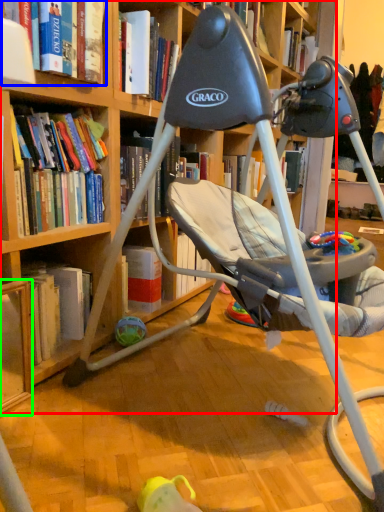
Question: Which object is the closest to the bookcase (highlighted by a red box)? Choose among these: book (highlighted by a blue box) or shelf (highlighted by a green box).

Choices:
 (A) book
 (B) shelf

Answer: (B)